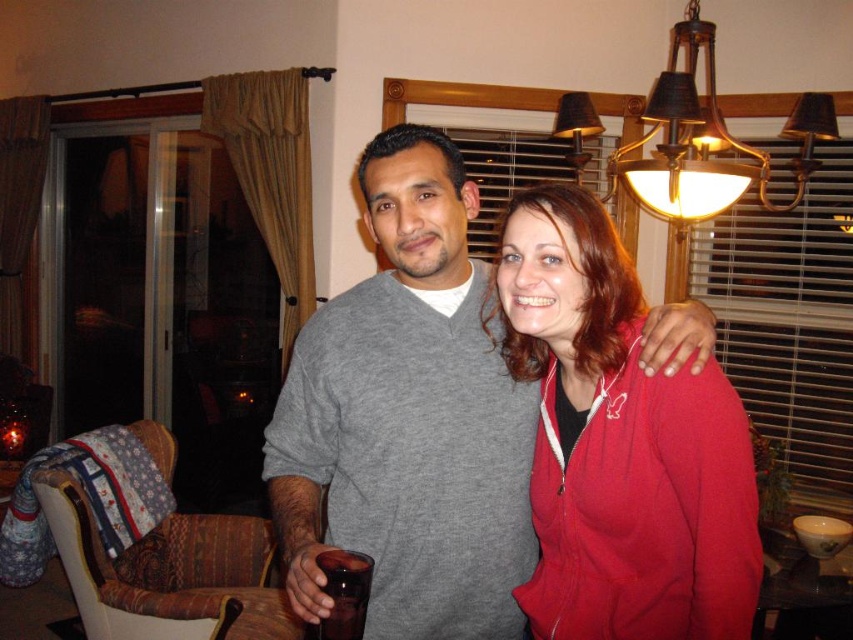
Can you confirm if gray matte sweater at center is taller than matte red hoodie at center?

Yes.

Is gray matte sweater at center wider than matte red hoodie at center?

Yes.

Between point (537, 392) and point (701, 442), which one is positioned in front?

Positioned in front is point (701, 442).

Locate an element on the screen. Image resolution: width=853 pixels, height=640 pixels. gray matte sweater at center is located at coordinates (407, 419).

Consider the image. Is gray matte sweater at center to the left of dark brown glass at center from the viewer's perspective?

No, gray matte sweater at center is not to the left of dark brown glass at center.

Can you confirm if gray matte sweater at center is wider than dark brown glass at center?

Yes.

Is point (685, 321) positioned in front of point (321, 627)?

No, it is not.

What are the coordinates of `gray matte sweater at center` in the screenshot? It's located at click(407, 419).

Between matte red hoodie at center and dark brown glass at center, which one has more height?

Standing taller between the two is matte red hoodie at center.

Which is more to the right, matte red hoodie at center or dark brown glass at center?

matte red hoodie at center

Between point (701, 422) and point (369, 582), which one is positioned in front?

Point (369, 582)

The height and width of the screenshot is (640, 853). I want to click on matte red hoodie at center, so click(x=619, y=445).